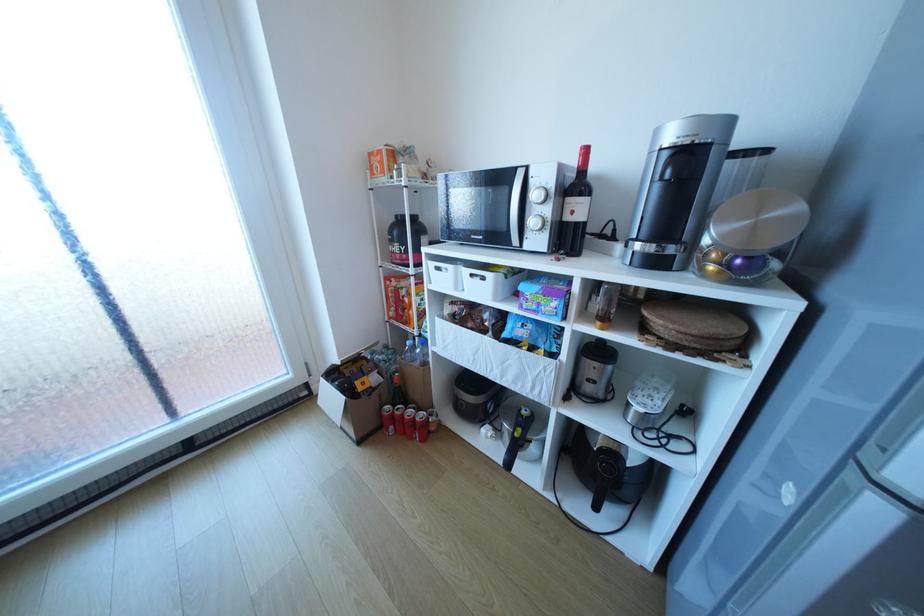
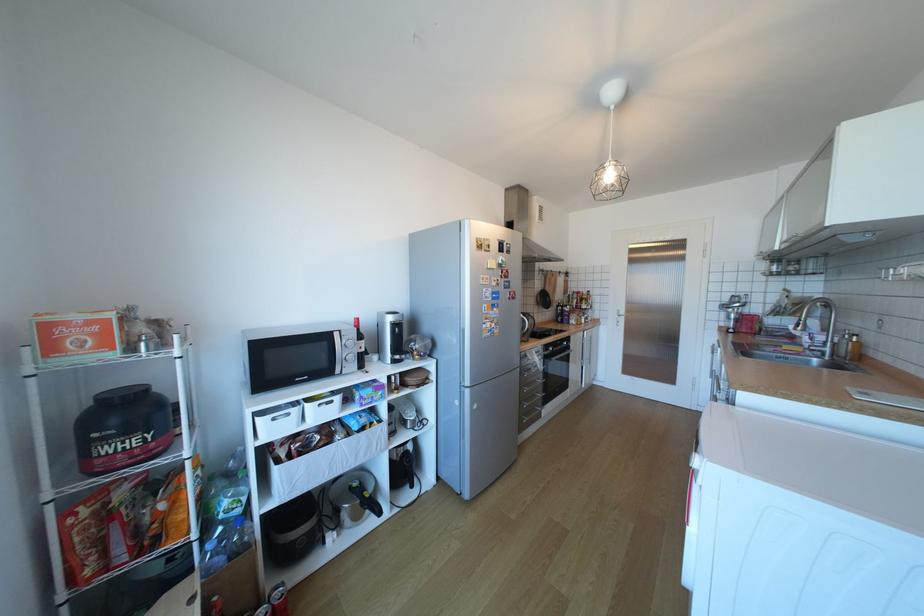
The point at (386, 171) is marked in the first image. Where is the corresponding point in the second image?

(91, 346)